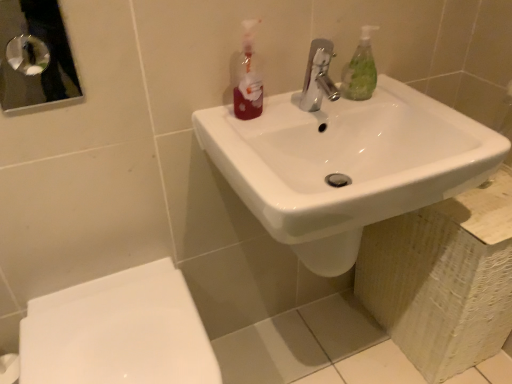
Locate an element on the screen. vacant space that is to the left of polished chrome faucet at center is located at coordinates (269, 122).